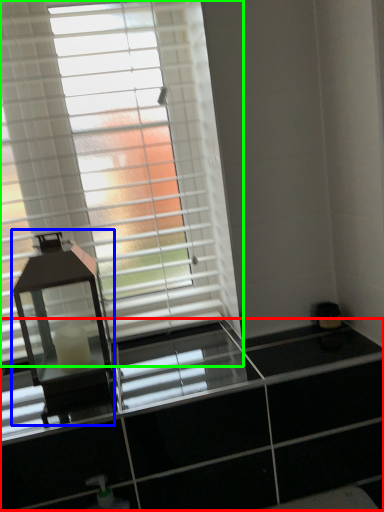
Question: Which is nearer to the dresser (highlighted by a red box)? table lamp (highlighted by a blue box) or window blind (highlighted by a green box).

Choices:
 (A) table lamp
 (B) window blind

Answer: (A)